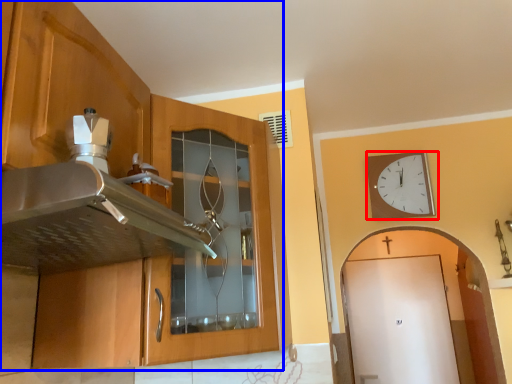
Question: Among these objects, which one is nearest to the camera, wall clock (highlighted by a red box) or cabinetry (highlighted by a blue box)?

Choices:
 (A) wall clock
 (B) cabinetry

Answer: (B)